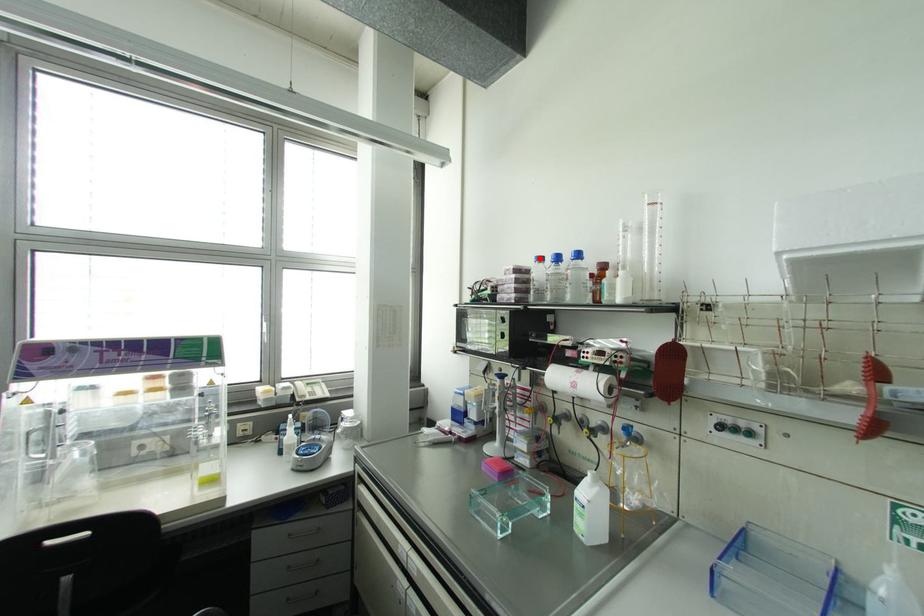
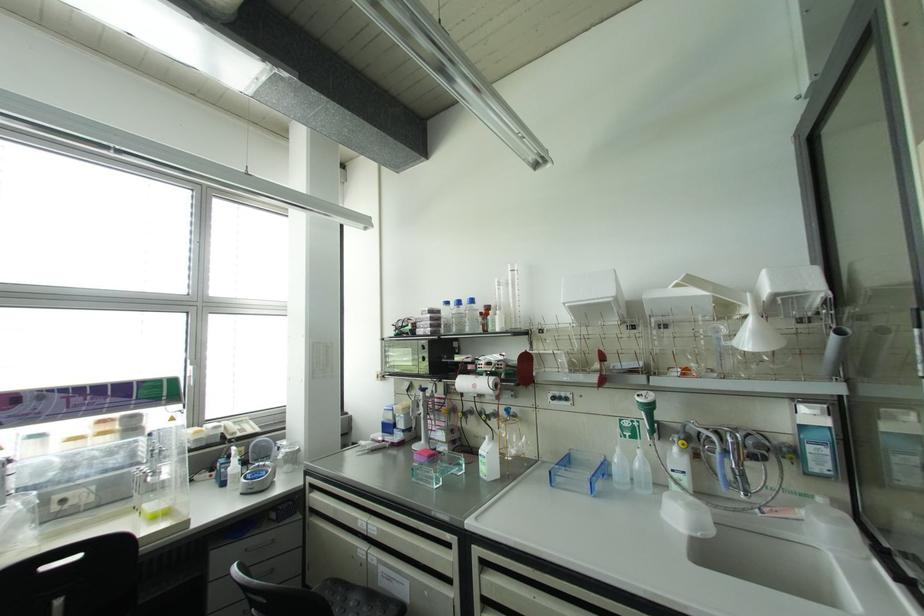
Find the pixel in the second image that matches the highlighted location in the first image.

(446, 302)